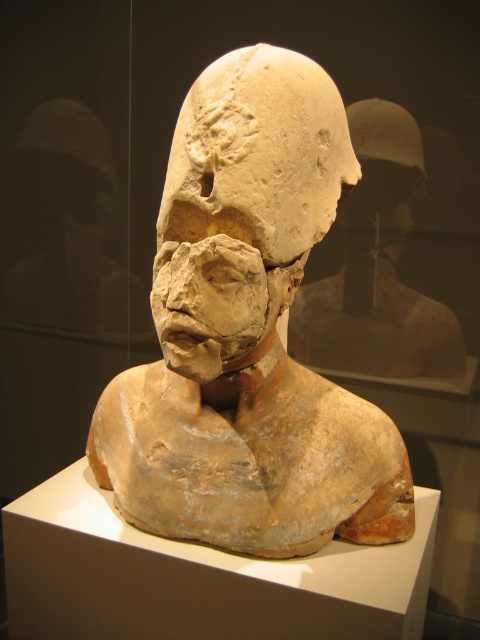
Question: Which point appears farthest from the camera in this image?

Choices:
 (A) (248, 49)
 (B) (216, 72)
 (C) (363, 179)

Answer: (C)

Question: Which object is closer to the camera taking this photo?

Choices:
 (A) matte clay head at center
 (B) earthenware sculpture at center
 (C) matte clay bust at center

Answer: (A)

Question: Does earthenware sculpture at center appear over matte clay bust at center?

Choices:
 (A) no
 (B) yes

Answer: (A)

Question: Can you confirm if earthenware sculpture at center is wider than matte clay head at center?

Choices:
 (A) no
 (B) yes

Answer: (B)

Question: Estimate the real-world distances between objects in this image. Which object is farther from the earthenware sculpture at center?

Choices:
 (A) matte clay head at center
 (B) matte clay bust at center

Answer: (B)

Question: From the image, what is the correct spatial relationship of matte clay head at center in relation to matte clay bust at center?

Choices:
 (A) right
 (B) left

Answer: (B)